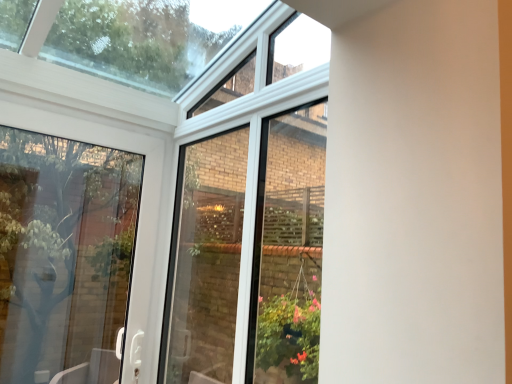
The width and height of the screenshot is (512, 384). What do you see at coordinates (250, 254) in the screenshot? I see `white glossy screen door at center` at bounding box center [250, 254].

I want to click on white glossy screen door at center, so click(250, 254).

This screenshot has height=384, width=512. Find the location of `white glossy screen door at center`. white glossy screen door at center is located at coordinates (250, 254).